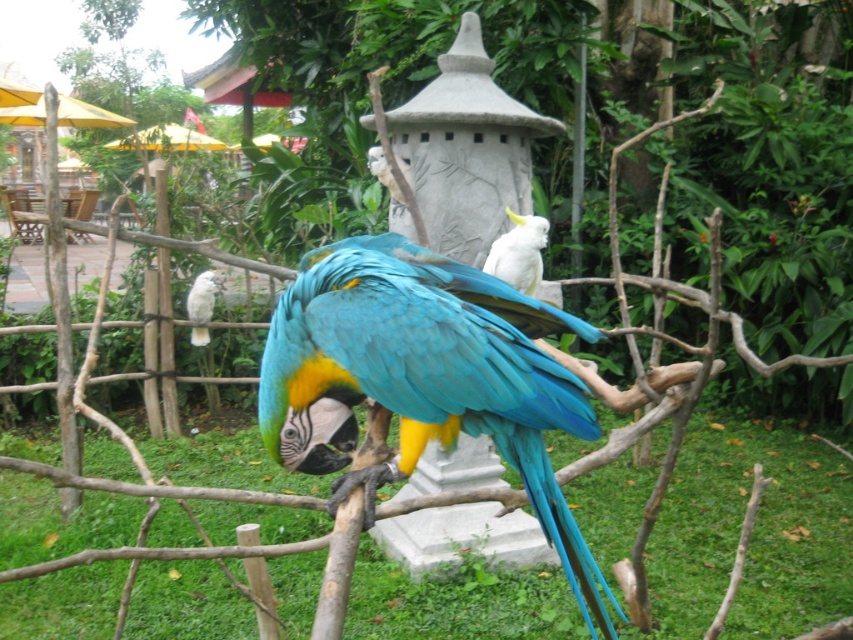
You are a birdwatcher observing two parrots in the park. You see the blue glossy parrot at center and the white feathered parrot at center. Which parrot is taller?

The blue glossy parrot at center is taller than the white feathered parrot at center.

You are a park ranger trying to locate the white matte parrot at center. According to the coordinates provided, where would you find it in the image?

The white matte parrot at center is located at point coordinates (519, 252).

You are a birdwatcher trying to photograph both the white matte parrot at center and the white feathered parrot at center. Since you want to focus on the one that is closer to you, which parrot should you aim your camera at?

The white matte parrot at center is closer to the viewer than the white feathered parrot at center, so you should aim your camera at the white matte parrot at center to focus on the closer one.